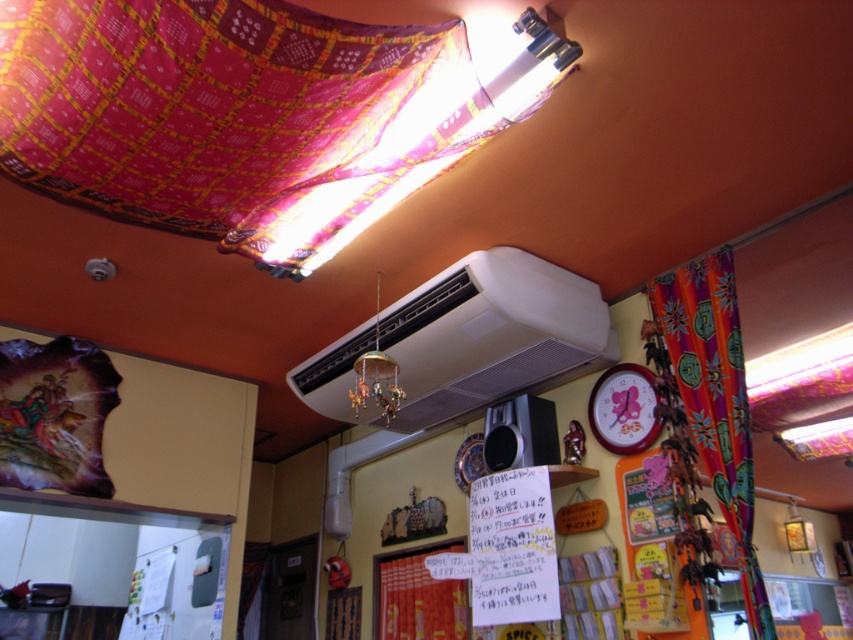
You are a customer entering the cozy restaurant and notice the multicolored fabric curtain at right and the wooden clock at upper right. From your perspective at the entrance, which object is positioned more to your right side?

The multicolored fabric curtain at right is positioned more to the right than the wooden clock at upper right, so the multicolored fabric curtain at right is more to your right side.

You are standing in the restaurant and want to hang a new picture. The red fabric tapestry at lower center is represented by point (419, 598). Where should you place the new picture so it is exactly to the right of the red fabric tapestry at lower center?

To place the new picture exactly to the right of the red fabric tapestry at lower center, you should position it at a coordinate point with an x value greater than 0.936 and the same y value of 0.492.

You are a customer in this cozy restaurant and want to hang a new small painting between the multicolored fabric curtain at right and the red fabric tapestry at lower center. Based on their sizes, which object should you place the painting closer to?

The multicolored fabric curtain at right is larger in size than the red fabric tapestry at lower center, so you should place the painting closer to the red fabric tapestry at lower center to avoid overwhelming it with the larger curtain.